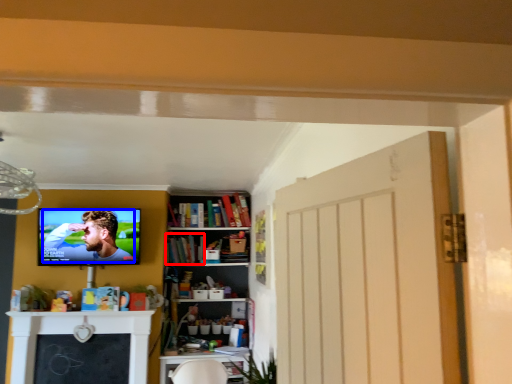
Question: Which object appears farthest to the camera in this image, book (highlighted by a red box) or person (highlighted by a blue box)?

Choices:
 (A) book
 (B) person

Answer: (A)